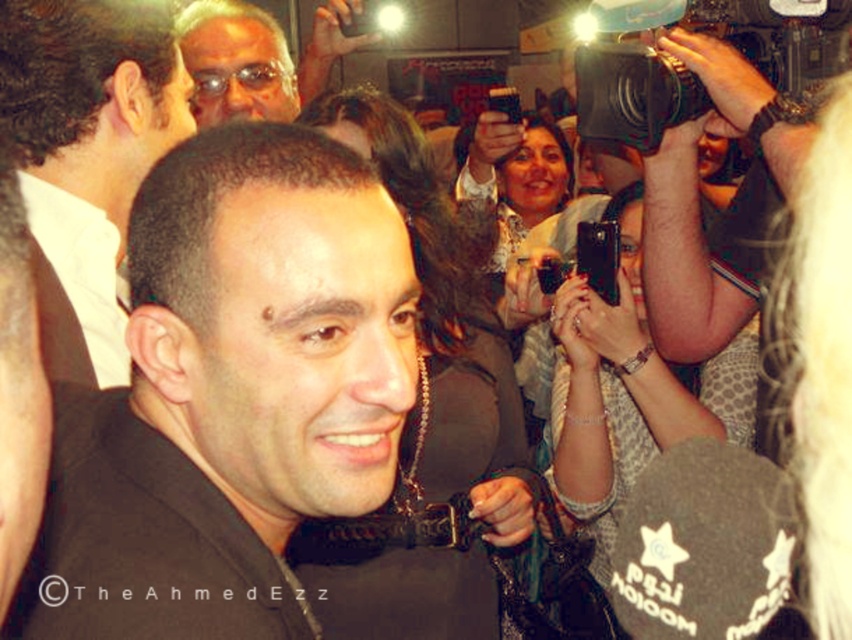
Question: Is black satin suit at center positioned in front of matte black glasses at upper left?

Choices:
 (A) no
 (B) yes

Answer: (B)

Question: Can you confirm if black satin suit at center is positioned to the right of matte black glasses at upper left?

Choices:
 (A) yes
 (B) no

Answer: (A)

Question: Which is farther from the matte black glasses at upper left?

Choices:
 (A) black plastic video camera at upper right
 (B) black glossy bow tie at center
 (C) black satin suit at center

Answer: (C)

Question: Which object is farther from the camera taking this photo?

Choices:
 (A) matte black glasses at upper left
 (B) black plastic video camera at upper right

Answer: (A)

Question: Is black glossy bow tie at center positioned behind black plastic video camera at upper right?

Choices:
 (A) no
 (B) yes

Answer: (A)

Question: Which object is positioned closest to the black plastic video camera at upper right?

Choices:
 (A) black satin suit at center
 (B) black glossy bow tie at center

Answer: (B)